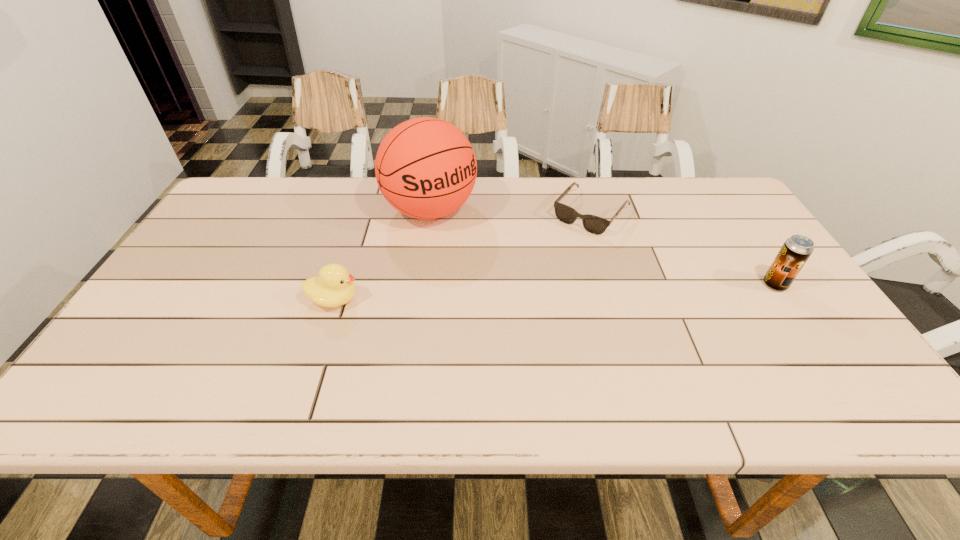
Identify the location of empty space that is in between the second shortest object and the tallest object. (382, 255).

You are a GUI agent. You are given a task and a screenshot of the screen. Output one action in this format:
    pyautogui.click(x=<x>, y=<y>)
    Task: Click on the free area in between the duckling and the tallest object
    This screenshot has width=960, height=540.
    Given the screenshot: What is the action you would take?
    coord(382,255)

This screenshot has height=540, width=960. Identify the location of free space that is in between the tallest object and the sunglasses. (511, 212).

Find the location of a particular element. object identified as the second closest to the duckling is located at coordinates (596, 225).

Locate an element on the screen. This screenshot has width=960, height=540. object that stands as the third closest to the tallest object is located at coordinates (796, 250).